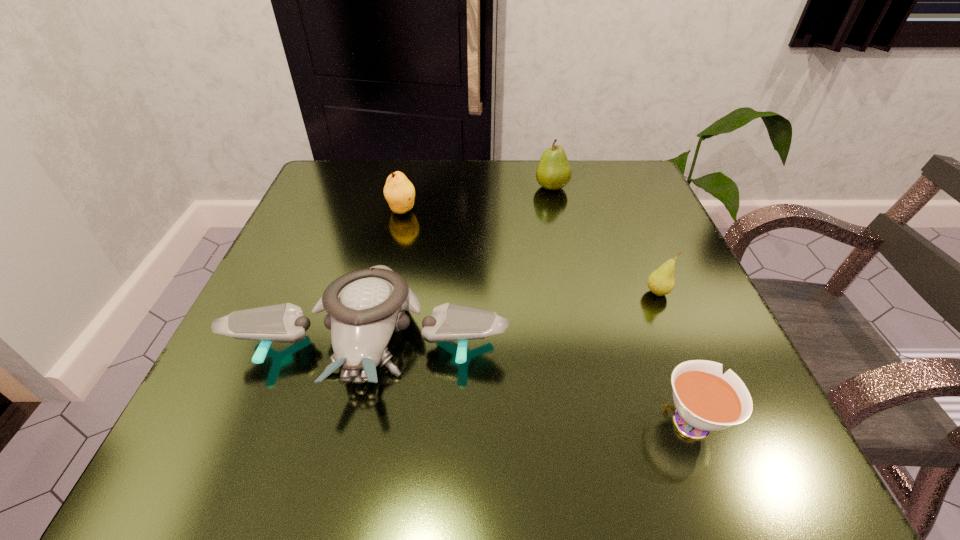
This screenshot has height=540, width=960. What are the coordinates of `empty space between the nearest pear and the teacup` in the screenshot? It's located at (673, 356).

Image resolution: width=960 pixels, height=540 pixels. Identify the location of vacant area that lies between the nearest pear and the drone. (515, 315).

Find the location of a particular element. vacant area that lies between the second pear from left to right and the leftmost pear is located at coordinates (477, 199).

Find the location of a particular element. This screenshot has width=960, height=540. free space between the nearest pear and the fourth nearest object is located at coordinates (530, 251).

Locate an element on the screen. empty space that is in between the third object from right to left and the drone is located at coordinates (462, 262).

At what (x,y) coordinates should I click in order to perform the action: click on the second closest object relative to the drone. Please return your answer as a coordinate pair (x, y). Looking at the image, I should click on (705, 400).

Locate which object ranks in proximity to the drone. Please provide its 2D coordinates. Your answer should be formatted as a tuple, i.e. [(x, y)], where the tuple contains the x and y coordinates of a point satisfying the conditions above.

[(399, 192)]

At what (x,y) coordinates should I click in order to perform the action: click on pear that is the closest to the third object from right to left. Please return your answer as a coordinate pair (x, y). This screenshot has width=960, height=540. Looking at the image, I should click on (399, 192).

Choose which pear is the nearest neighbor to the drone. Please provide its 2D coordinates. Your answer should be formatted as a tuple, i.e. [(x, y)], where the tuple contains the x and y coordinates of a point satisfying the conditions above.

[(399, 192)]

You are a GUI agent. You are given a task and a screenshot of the screen. Output one action in this format:
    pyautogui.click(x=<x>, y=<y>)
    Task: Click on the vacant space that satisfies the following two spatial constraints: 1. on the side of the nearest pear with the handle; 2. on the right side of the teacup
    The width and height of the screenshot is (960, 540).
    Given the screenshot: What is the action you would take?
    pyautogui.click(x=641, y=293)